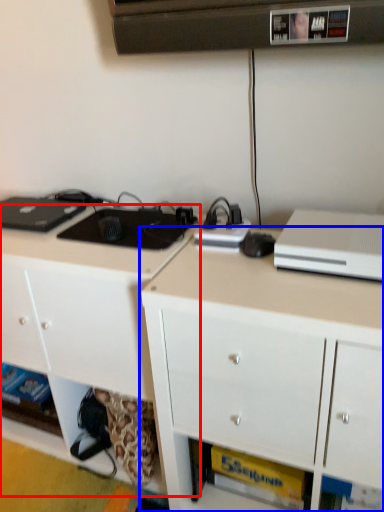
Question: Which point is closer to the camera, cabinetry (highlighted by a red box) or cabinetry (highlighted by a blue box)?

Choices:
 (A) cabinetry
 (B) cabinetry

Answer: (B)